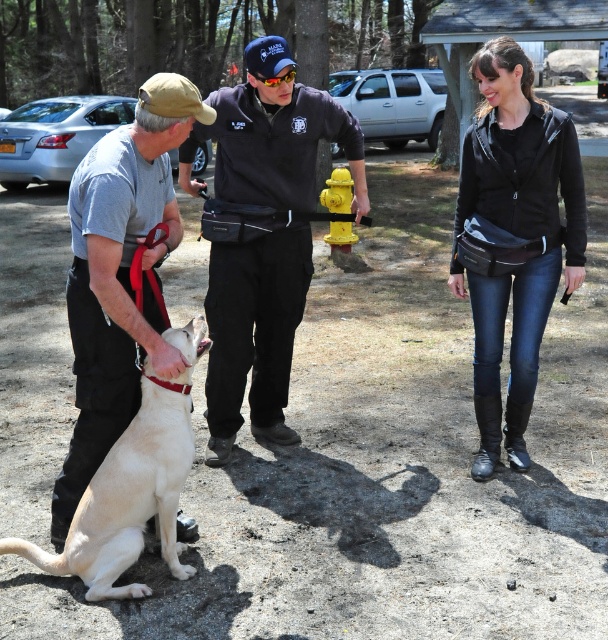
You are a delivery person carrying a package that requires a secure drop location. You see the black leather jacket at center and the light beige fabric dog at left. Which object can you use to temporarily place the package?

The black leather jacket at center can be used to temporarily place the package because it is an inanimate object, whereas the light beige fabric dog at left is a living creature and should not be used as a surface.

You are a photographer standing in the park and want to take a photo that includes both the black smooth uniform at center and the light beige fabric dog at left. Based on their positions, which object should you focus on first to ensure both are in the frame?

The black smooth uniform at center is to the right of the light beige fabric dog at left. To ensure both are in the frame, focus on the light beige fabric dog at left first, then pan to the right to include the black smooth uniform at center.

You are a photographer setting up a tripod in the center of the scene. You need to ensure that the black smooth uniform at center and the light beige fabric dog at left are both visible in your shot. Given their sizes, which object will require more space in the frame?

The black smooth uniform at center requires more space in the frame because its width is larger than the light beige fabric dog at left.